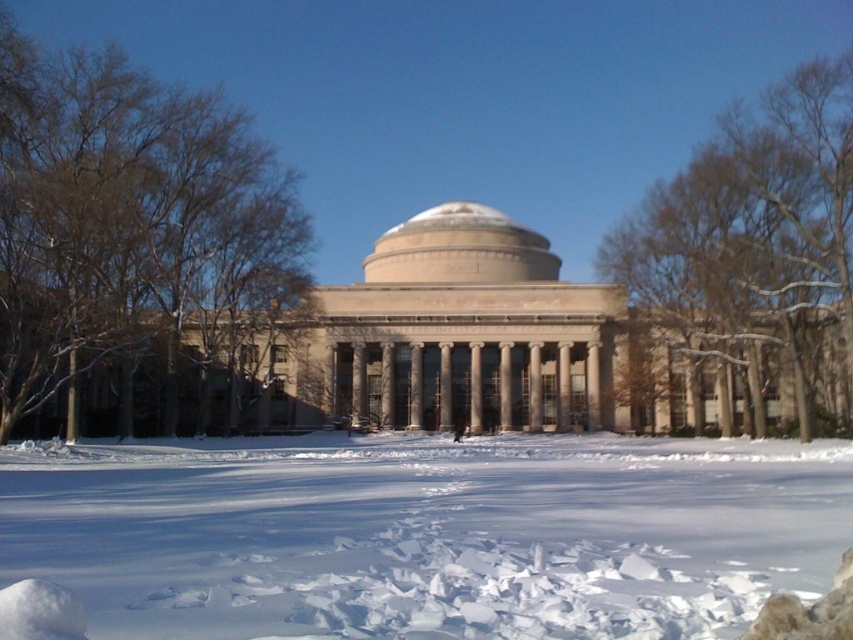
You are standing at the entrance of the classical building with a prominent dome. You want to walk directly towards the white powdery snow at center. Which direction should you head?

The white powdery snow at center is located at point coordinates 0.836 on the x axis and 0.501 on the y axis. Since the entrance is at the front of the building, you should head forward to reach the white powdery snow at center as it is positioned directly ahead in the central area.

Consider the image. You are standing in front of the classical building with the dome covered in snow. You notice a point marked at coordinates (x=755, y=241). What object is located at that point?

The point at (x=755, y=241) indicates a brown leafless tree at upper right.